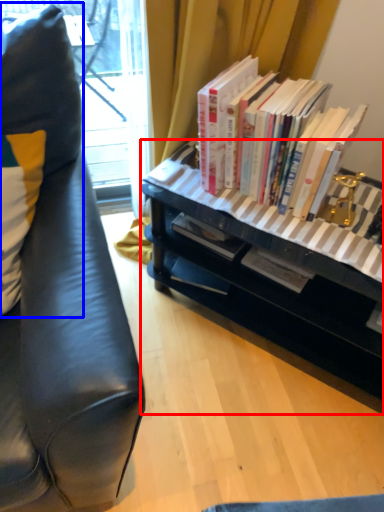
Question: Which object appears farthest to the camera in this image, desk (highlighted by a red box) or pillow (highlighted by a blue box)?

Choices:
 (A) desk
 (B) pillow

Answer: (A)